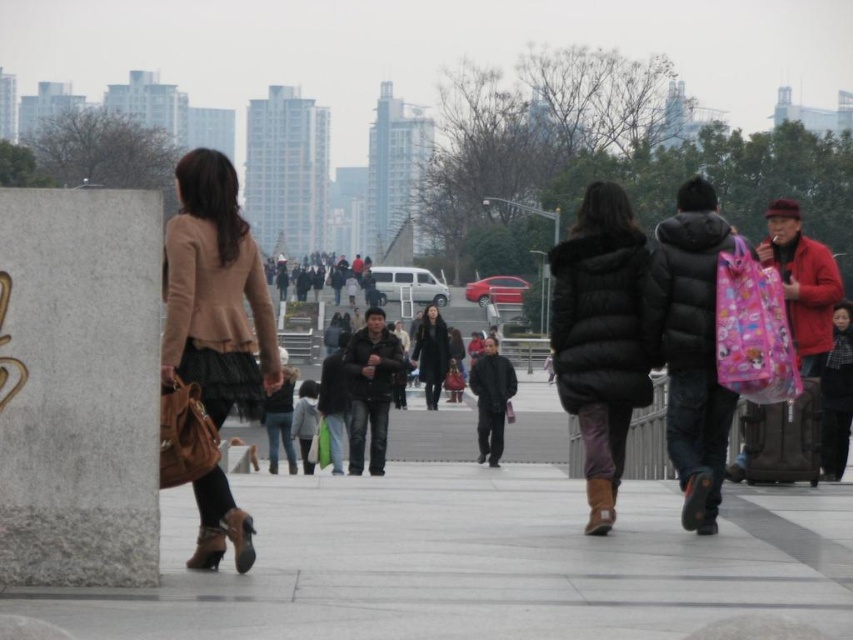
Does black fur coat at center have a larger size compared to black leather coat at center?

No, black fur coat at center is not bigger than black leather coat at center.

Who is more forward, (630,211) or (418,364)?

Point (630,211) is in front.

At what (x,y) coordinates should I click in order to perform the action: click on black fur coat at center. Please return your answer as a coordinate pair (x, y). This screenshot has width=853, height=640. Looking at the image, I should click on (601, 337).

Looking at this image, can you confirm if gray concrete pavement at center is positioned to the left of black leather coat at center?

No, gray concrete pavement at center is not to the left of black leather coat at center.

This screenshot has width=853, height=640. In order to click on gray concrete pavement at center in this screenshot , I will do `click(477, 563)`.

Between point (180, 240) and point (438, 364), which one is positioned behind?

The point (438, 364) is behind.

Does point (227, 506) come farther from viewer compared to point (434, 348)?

No, it is in front of (434, 348).

Where is `matte beige coat at left`? This screenshot has width=853, height=640. matte beige coat at left is located at coordinates (215, 294).